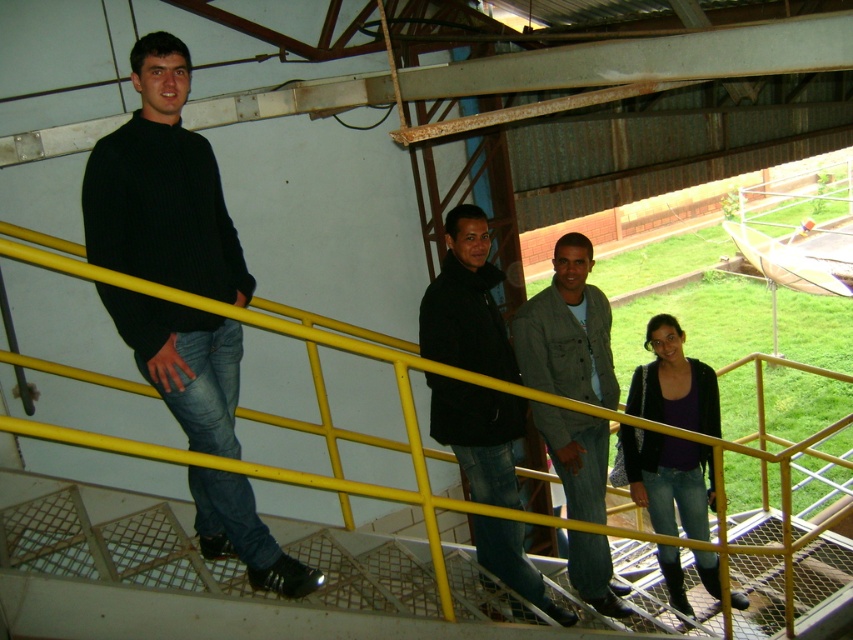
Looking at this image, which of these two, black matte jacket at center or denim jacket at center, stands taller?

denim jacket at center

Can you confirm if black matte jacket at center is shorter than denim jacket at center?

Correct, black matte jacket at center is not as tall as denim jacket at center.

Between point (511, 442) and point (572, 339), which one is positioned behind?

The point (511, 442) is more distant.

Locate an element on the screen. The image size is (853, 640). black matte jacket at center is located at coordinates (466, 301).

Who is higher up, black ribbed sweater at left or black matte jacket at center?

Positioned higher is black ribbed sweater at left.

In the scene shown: Which is more to the left, black ribbed sweater at left or black matte jacket at center?

black ribbed sweater at left

Does point (175, 312) come closer to viewer compared to point (521, 534)?

Yes, point (175, 312) is closer to viewer.

In order to click on black ribbed sweater at left in this screenshot , I will do `click(161, 188)`.

Is point (141, 394) positioned in front of point (624, 476)?

Yes, point (141, 394) is closer to viewer.

Between point (18, 531) and point (683, 515), which one is positioned in front?

Point (18, 531)

Between point (479, 592) and point (659, 394), which one is positioned in front?

Point (479, 592) is more forward.

Where is `yellow metal railing at upper left`? This screenshot has height=640, width=853. yellow metal railing at upper left is located at coordinates (225, 586).